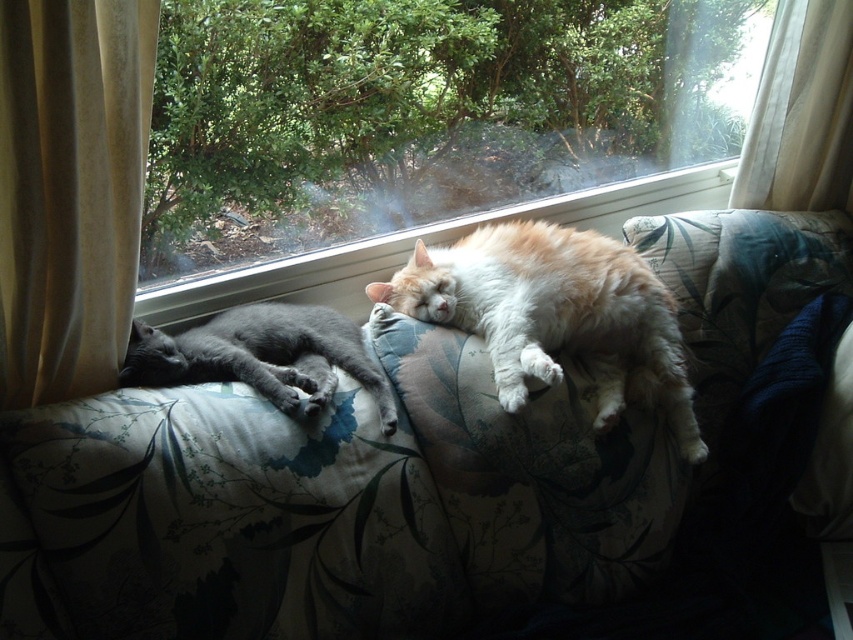
You are a photographer trying to capture a clear photo of the fluffy orange cat at center without the white sheer curtain at upper right showing in the background. Based on their positions, is this possible?

The fluffy orange cat at center is in front of the white sheer curtain at upper right, so you can take a photo focusing on the cat while the curtain will be partially visible behind it. To avoid the curtain entirely, you might need to adjust the angle or position.

You are a photographer trying to capture the cats on the floral fabric couch at center. To ensure the cats are in the frame, where should you position yourself relative to the point marked at coordinates point (325, 506)?

The point marked at coordinates point (325, 506) marks the floral fabric couch at center, so you should position yourself directly in front of this point to ensure the cats are centered in the frame.